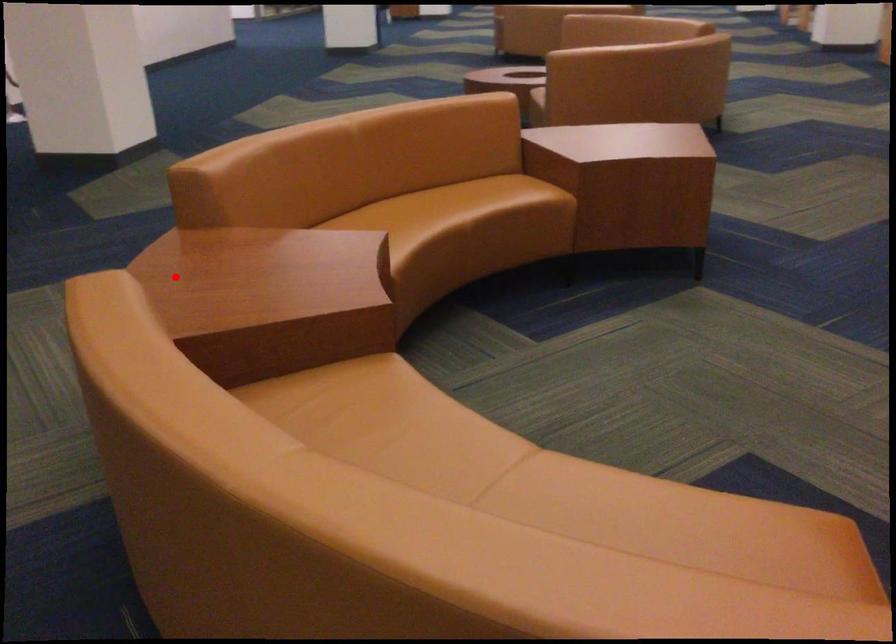
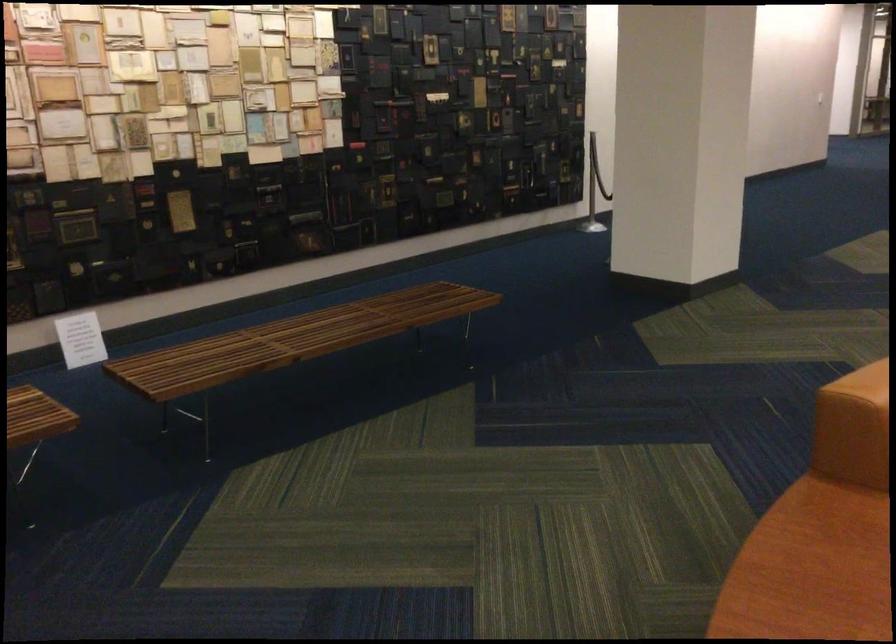
Question: I am providing you with two images of the same scene from different viewpoints. A red point is shown in image1. For the corresponding object point in image2, is it positioned nearer or farther from the camera?

Choices:
 (A) Nearer
 (B) Farther

Answer: (A)